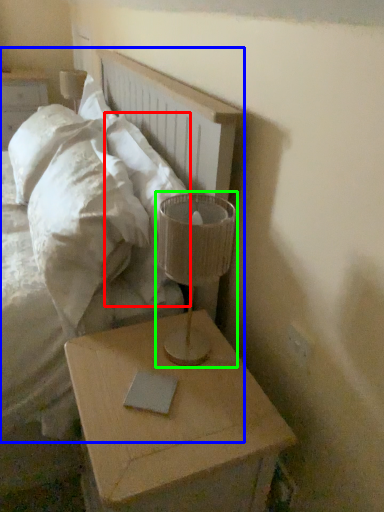
Question: Based on their relative distances, which object is farther from pillow (highlighted by a red box)? Choose from bed (highlighted by a blue box) and table lamp (highlighted by a green box).

Choices:
 (A) bed
 (B) table lamp

Answer: (B)